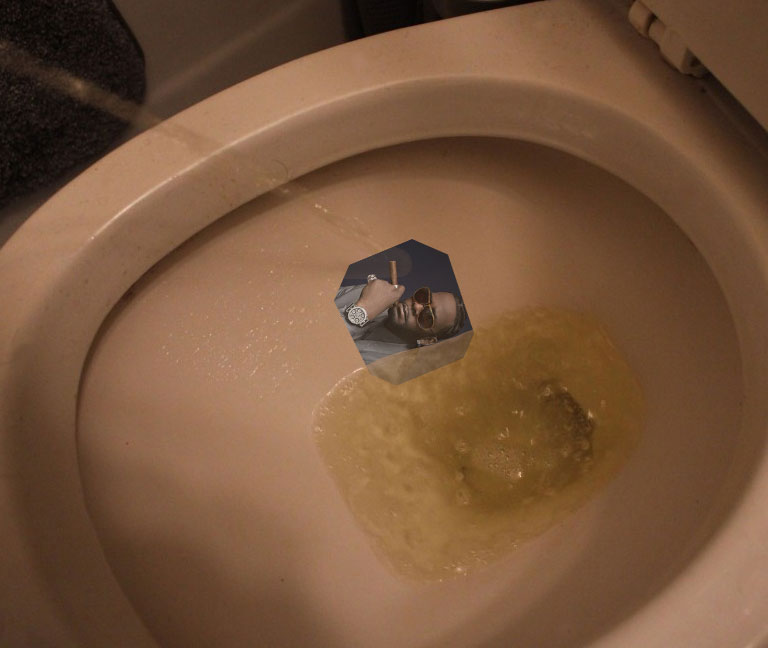
The height and width of the screenshot is (648, 768). What are the coordinates of `toilet lid` in the screenshot? It's located at [x=739, y=50].